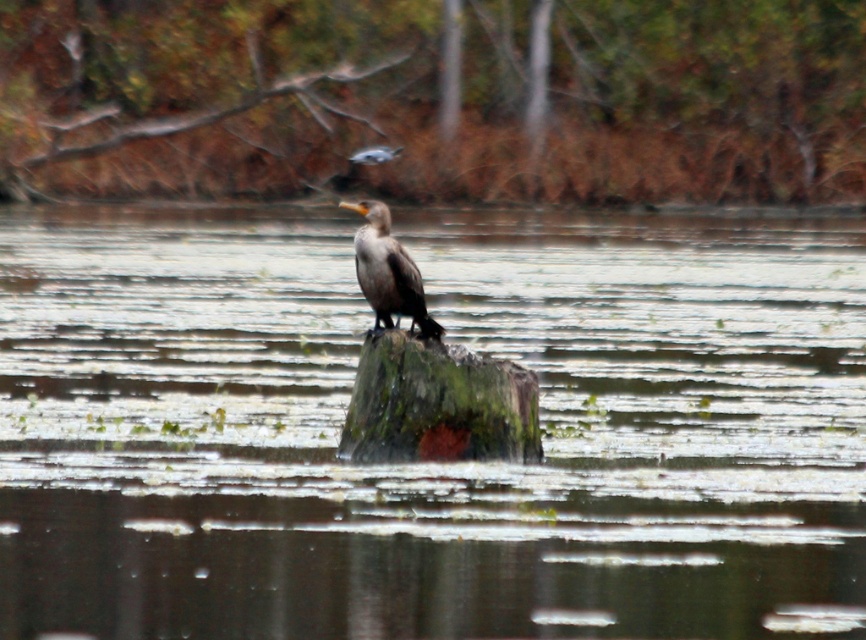
Question: Based on their relative distances, which object is nearer to the green mossy stump at center?

Choices:
 (A) dark brown feathers at center
 (B) green mossy log at center
 (C) brown wood at upper center

Answer: (A)

Question: Can you confirm if green mossy log at center is bigger than green mossy stump at center?

Choices:
 (A) yes
 (B) no

Answer: (A)

Question: Is green mossy log at center positioned at the back of brown wood at upper center?

Choices:
 (A) no
 (B) yes

Answer: (A)

Question: Can you confirm if green mossy log at center is positioned above dark brown feathers at center?

Choices:
 (A) yes
 (B) no

Answer: (A)

Question: Among these objects, which one is nearest to the camera?

Choices:
 (A) brown wood at upper center
 (B) green mossy log at center
 (C) green mossy stump at center
 (D) dark brown feathers at center

Answer: (B)

Question: Which object is closer to the camera taking this photo?

Choices:
 (A) brown wood at upper center
 (B) green mossy stump at center
 (C) green mossy log at center
 (D) dark brown feathers at center

Answer: (C)